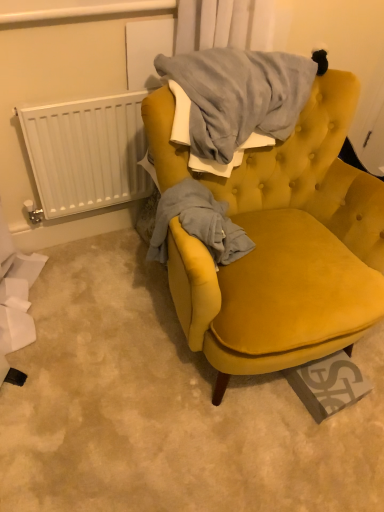
Question: Is white plastic radiator at left inside the boundaries of velvet yellow armchair at center, or outside?

Choices:
 (A) inside
 (B) outside

Answer: (B)

Question: Based on their positions, is white plastic radiator at left located to the left or right of velvet yellow armchair at center?

Choices:
 (A) left
 (B) right

Answer: (A)

Question: From the image's perspective, relative to velvet yellow armchair at center, is white plastic radiator at left above or below?

Choices:
 (A) above
 (B) below

Answer: (A)

Question: Is velvet yellow armchair at center to the left or to the right of white plastic radiator at left in the image?

Choices:
 (A) right
 (B) left

Answer: (A)

Question: In terms of size, does velvet yellow armchair at center appear bigger or smaller than white plastic radiator at left?

Choices:
 (A) small
 (B) big

Answer: (B)

Question: Is velvet yellow armchair at center taller or shorter than white plastic radiator at left?

Choices:
 (A) tall
 (B) short

Answer: (A)

Question: From the image's perspective, is velvet yellow armchair at center located above or below white plastic radiator at left?

Choices:
 (A) above
 (B) below

Answer: (B)